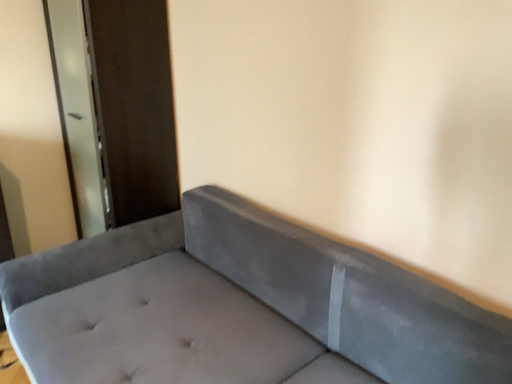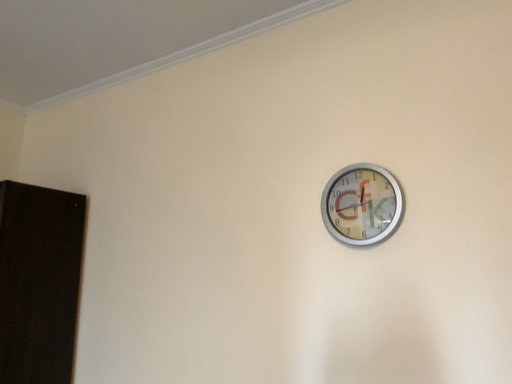
Question: How did the camera likely rotate when shooting the video?

Choices:
 (A) rotated downward
 (B) rotated upward

Answer: (B)